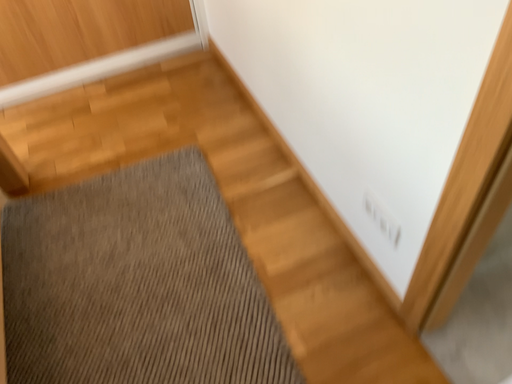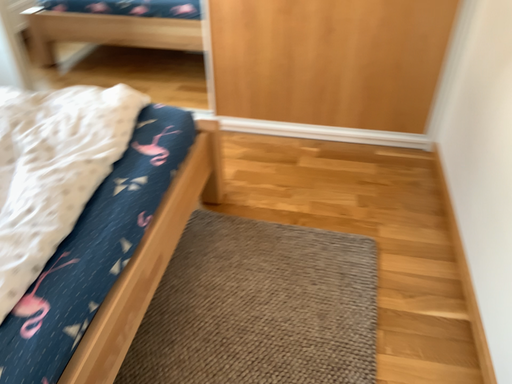
Question: How did the camera likely rotate when shooting the video?

Choices:
 (A) rotated left
 (B) rotated right

Answer: (A)